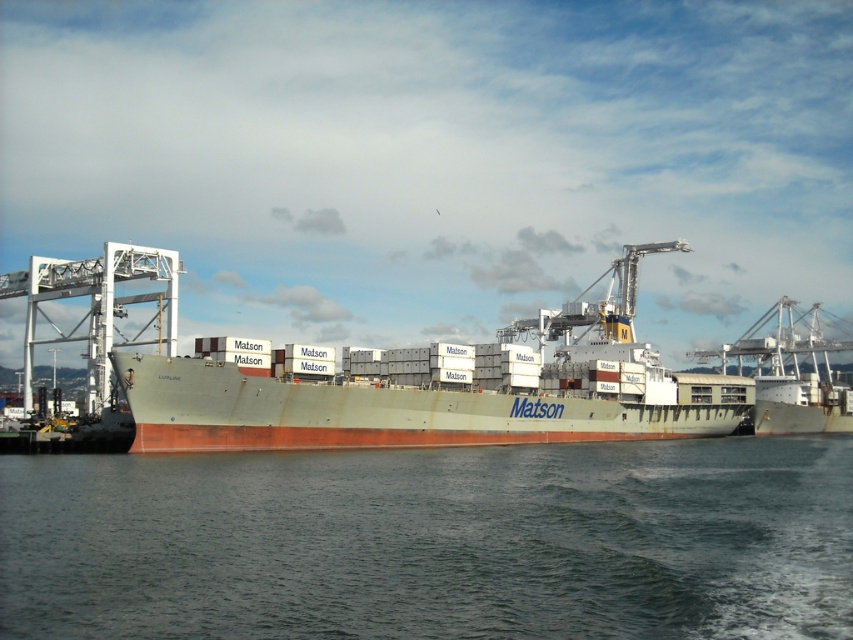
Question: Can you confirm if dark blue water at center is positioned below green matte container ship at center?

Choices:
 (A) no
 (B) yes

Answer: (B)

Question: Can you confirm if dark blue water at center is positioned to the right of green matte container ship at center?

Choices:
 (A) yes
 (B) no

Answer: (B)

Question: Which point appears farthest from the camera in this image?

Choices:
 (A) (177, 410)
 (B) (556, 589)

Answer: (A)

Question: Can you confirm if dark blue water at center is positioned to the right of green matte container ship at center?

Choices:
 (A) no
 (B) yes

Answer: (A)